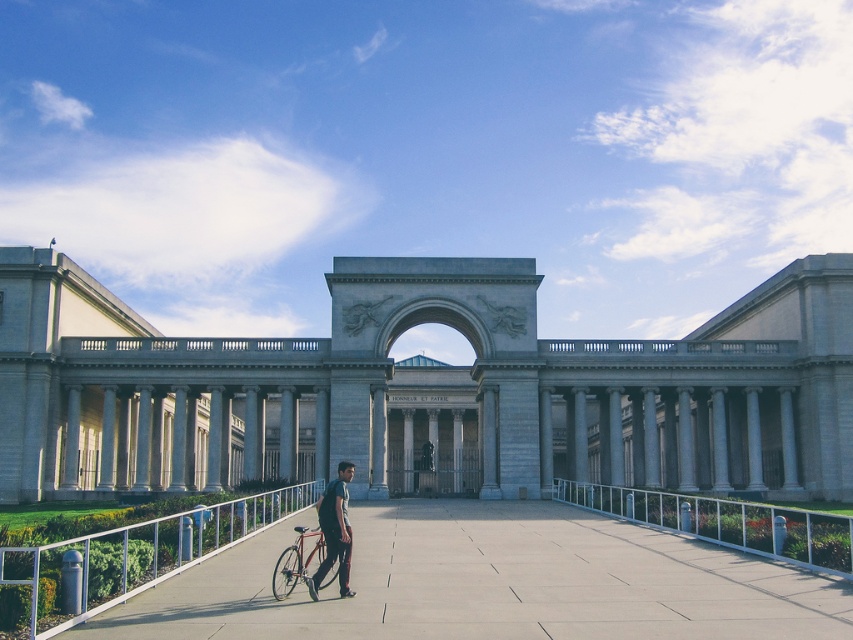
Question: Is concrete pavement at center bigger than shiny metallic bicycle at center?

Choices:
 (A) no
 (B) yes

Answer: (B)

Question: Based on their relative distances, which object is farther from the white metal railing at lower right?

Choices:
 (A) dark gray fabric backpack at center
 (B) concrete pavement at center
 (C) gray stone palace at center
 (D) white metal railing at lower left

Answer: (D)

Question: Which object is closer to the camera taking this photo?

Choices:
 (A) white metal railing at lower left
 (B) gray stone palace at center
 (C) concrete pavement at center
 (D) shiny metallic bicycle at center

Answer: (C)

Question: Is concrete pavement at center above white metal railing at lower right?

Choices:
 (A) yes
 (B) no

Answer: (B)

Question: Can you confirm if concrete pavement at center is thinner than white metal railing at lower left?

Choices:
 (A) yes
 (B) no

Answer: (B)

Question: Which point is farther to the camera?

Choices:
 (A) white metal railing at lower right
 (B) concrete pavement at center

Answer: (A)